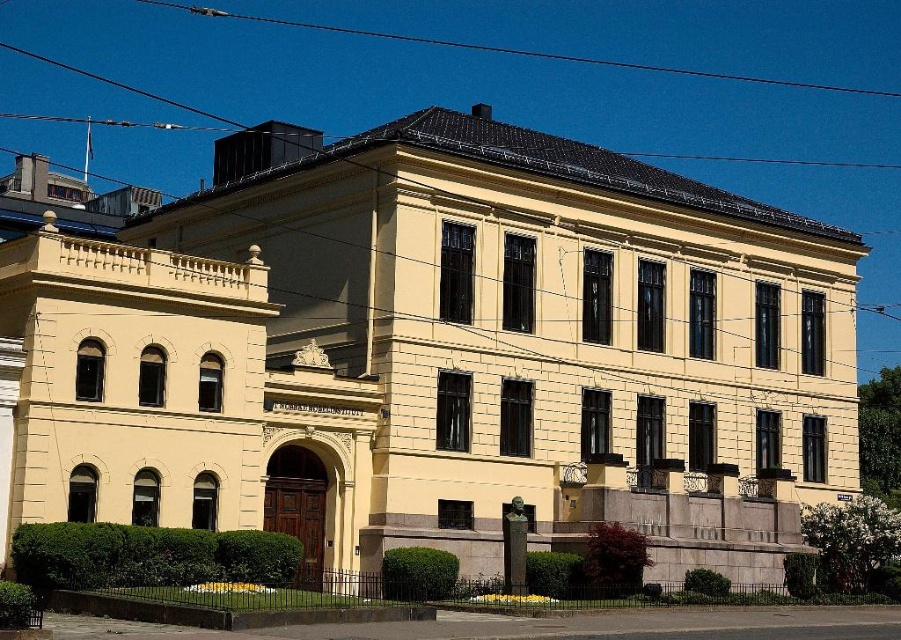
Is black wire at upper center closer to the viewer compared to bronze statue at center?

No, black wire at upper center is behind bronze statue at center.

Who is higher up, black wire at upper center or bronze statue at center?

Positioned higher is black wire at upper center.

The width and height of the screenshot is (901, 640). Describe the element at coordinates (519, 51) in the screenshot. I see `black wire at upper center` at that location.

At what (x,y) coordinates should I click in order to perform the action: click on black wire at upper center. Please return your answer as a coordinate pair (x, y). Looking at the image, I should click on [x=519, y=51].